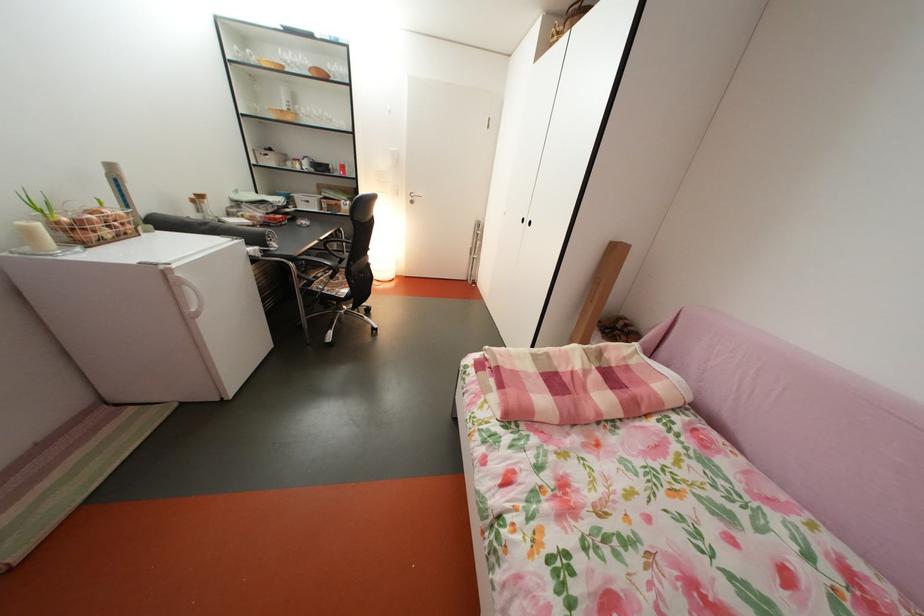
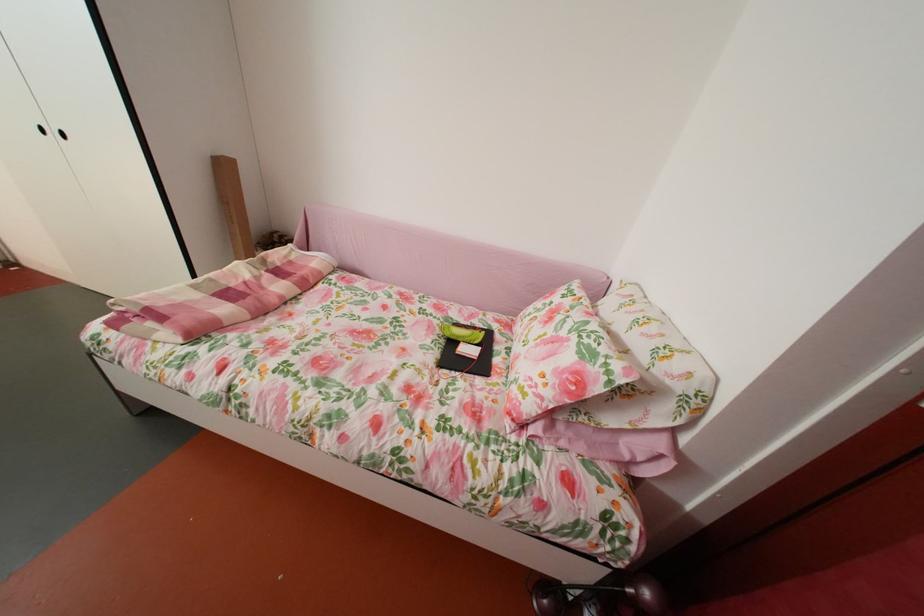
The point at (604, 374) is marked in the first image. Where is the corresponding point in the second image?

(274, 278)